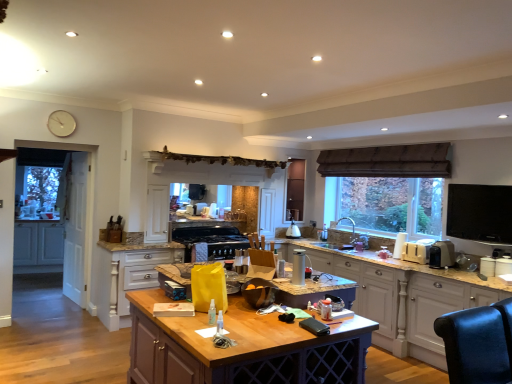
Question: From a real-world perspective, is black glass stove at center, placed as the 4th appliance when sorted from right to left, under matte white cabinets at left, which is the 3th cabinetry in front-to-back order?

Choices:
 (A) no
 (B) yes

Answer: (A)

Question: Can you confirm if black glass stove at center, which is counted as the 1th appliance, starting from the left, is wider than matte white cabinets at left, acting as the first cabinetry starting from the left?

Choices:
 (A) yes
 (B) no

Answer: (A)

Question: Does black glass stove at center, the 4th appliance viewed from the front, come behind matte white cabinets at left, the 1th cabinetry viewed from the back?

Choices:
 (A) no
 (B) yes

Answer: (A)

Question: From the image's perspective, does black glass stove at center, placed as the 4th appliance when sorted from right to left, appear higher than matte white cabinets at left, which appears as the 3th cabinetry when viewed from the right?

Choices:
 (A) no
 (B) yes

Answer: (B)

Question: Is black glass stove at center, acting as the first appliance starting from the back, smaller than matte white cabinets at left, acting as the first cabinetry starting from the left?

Choices:
 (A) yes
 (B) no

Answer: (A)

Question: Would you say white wood drawers at center, the second cabinetry in the left-to-right sequence, is to the left or to the right of black plastic toaster at right, acting as the second appliance starting from the front, in the picture?

Choices:
 (A) right
 (B) left

Answer: (B)

Question: From the image's perspective, is white wood drawers at center, the second cabinetry in the left-to-right sequence, located above or below black plastic toaster at right, the third appliance viewed from the back?

Choices:
 (A) above
 (B) below

Answer: (B)

Question: Which is correct: white wood drawers at center, which is the second cabinetry from right to left, is inside black plastic toaster at right, which is the first appliance in right-to-left order, or outside of it?

Choices:
 (A) outside
 (B) inside

Answer: (A)

Question: Considering the positions of point (100, 319) and point (440, 243), is point (100, 319) closer or farther from the camera than point (440, 243)?

Choices:
 (A) farther
 (B) closer

Answer: (A)

Question: From the image's perspective, relative to silver metallic thermos at center, the first appliance from the front, is white wood drawers at center, which appears as the second cabinetry when viewed from the front, above or below?

Choices:
 (A) above
 (B) below

Answer: (B)

Question: From a real-world perspective, is white wood drawers at center, which appears as the second cabinetry when viewed from the front, above or below silver metallic thermos at center, marked as the third appliance in a right-to-left arrangement?

Choices:
 (A) below
 (B) above

Answer: (A)

Question: Considering the positions of point (157, 286) and point (294, 273), is point (157, 286) closer or farther from the camera than point (294, 273)?

Choices:
 (A) closer
 (B) farther

Answer: (B)

Question: Is white wood drawers at center, the second cabinetry in the left-to-right sequence, bigger or smaller than silver metallic thermos at center, which appears as the second appliance when viewed from the left?

Choices:
 (A) small
 (B) big

Answer: (B)

Question: Is white wood drawers at center, which appears as the second cabinetry when viewed from the front, to the left or to the right of wooden table at center in the image?

Choices:
 (A) right
 (B) left

Answer: (B)

Question: Is white wood drawers at center, which appears as the second cabinetry when viewed from the front, inside the boundaries of wooden table at center, or outside?

Choices:
 (A) inside
 (B) outside

Answer: (B)